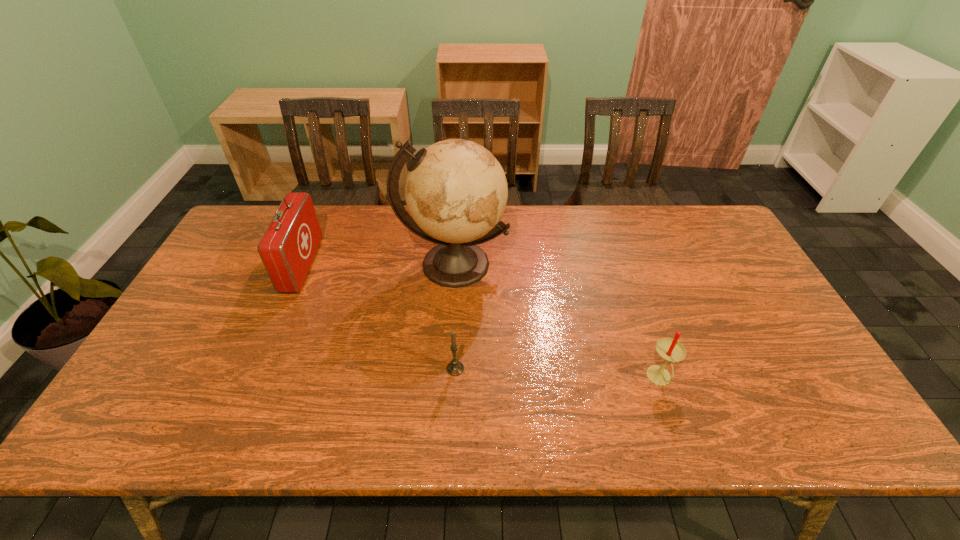
Find the location of `vacant space that satisfies the following two spatial constraints: 1. on the back side of the right candle; 2. on the side of the third shortest object with the first aid cross symbol`. vacant space that satisfies the following two spatial constraints: 1. on the back side of the right candle; 2. on the side of the third shortest object with the first aid cross symbol is located at coordinates (621, 266).

Locate an element on the screen. This screenshot has height=540, width=960. blank area in the image that satisfies the following two spatial constraints: 1. on the side of the first-aid kit with the first aid cross symbol; 2. on the right side of the right candle is located at coordinates (253, 379).

Find the location of a particular element. The width and height of the screenshot is (960, 540). vacant area in the image that satisfies the following two spatial constraints: 1. on the side of the third shortest object with the first aid cross symbol; 2. on the right side of the left candle is located at coordinates (258, 369).

Where is `vacant space that satisfies the following two spatial constraints: 1. on the front-facing side of the shortest object; 2. on the right side of the tallest object`? vacant space that satisfies the following two spatial constraints: 1. on the front-facing side of the shortest object; 2. on the right side of the tallest object is located at coordinates (447, 369).

Locate an element on the screen. This screenshot has width=960, height=540. free space that satisfies the following two spatial constraints: 1. on the front-facing side of the third tallest object; 2. on the left side of the globe is located at coordinates (446, 379).

This screenshot has height=540, width=960. I want to click on free location that satisfies the following two spatial constraints: 1. on the side of the second tallest object with the first aid cross symbol; 2. on the left side of the left candle, so click(x=258, y=369).

The height and width of the screenshot is (540, 960). Find the location of `blank space that satisfies the following two spatial constraints: 1. on the side of the shorter candle with the first aid cross symbol; 2. on the right side of the leftmost object`. blank space that satisfies the following two spatial constraints: 1. on the side of the shorter candle with the first aid cross symbol; 2. on the right side of the leftmost object is located at coordinates (258, 369).

Image resolution: width=960 pixels, height=540 pixels. What are the coordinates of `free space in the image that satisfies the following two spatial constraints: 1. on the front-facing side of the globe; 2. on the left side of the taller candle` in the screenshot? It's located at (446, 379).